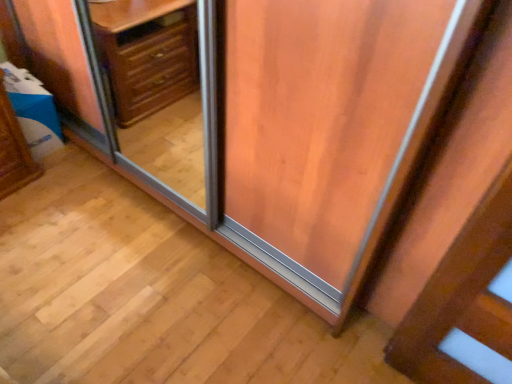
The width and height of the screenshot is (512, 384). Describe the element at coordinates (13, 150) in the screenshot. I see `matte brown cabinet at lower left` at that location.

Locate an element on the screen. Image resolution: width=512 pixels, height=384 pixels. matte brown cabinet at lower left is located at coordinates (13, 150).

I want to click on matte brown cabinet at lower left, so click(x=13, y=150).